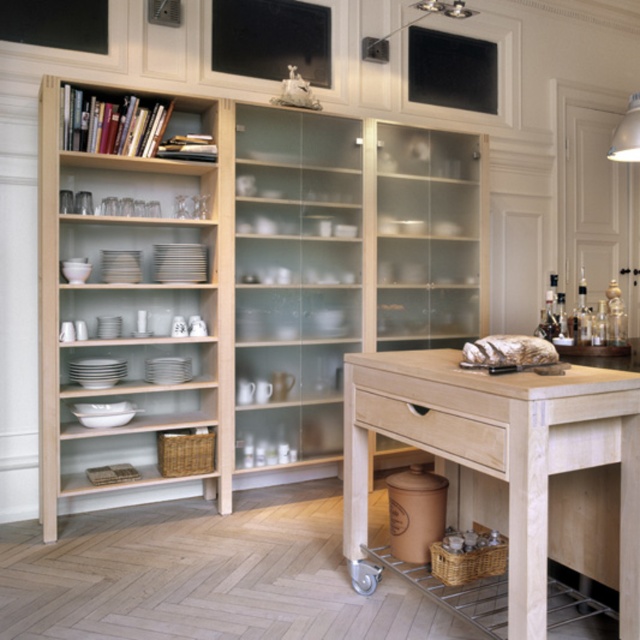
Who is positioned more to the right, light wood bookshelf at left or light wood drawer at center?

Positioned to the right is light wood drawer at center.

Can you confirm if light wood bookshelf at left is taller than light wood drawer at center?

Indeed, light wood bookshelf at left has a greater height compared to light wood drawer at center.

Which is in front, point (42, 275) or point (445, 432)?

Point (445, 432) is more forward.

You are a GUI agent. You are given a task and a screenshot of the screen. Output one action in this format:
    pyautogui.click(x=<x>, y=<y>)
    Task: Click on the light wood bookshelf at left
    Image resolution: width=640 pixels, height=640 pixels.
    Given the screenshot: What is the action you would take?
    pyautogui.click(x=138, y=307)

Between natural wood bookshelf at upper left and light wood table at center, which one is positioned higher?

Positioned higher is natural wood bookshelf at upper left.

Measure the distance between natural wood bookshelf at upper left and camera.

natural wood bookshelf at upper left is 3.03 meters away from camera.

Is point (317, 337) farther from camera compared to point (360, 516)?

That is True.

In order to click on natural wood bookshelf at upper left in this screenshot , I will do `click(244, 285)`.

Does point (240, 346) come in front of point (355, 404)?

That is False.

Is natural wood bookshelf at upper left further to the viewer compared to light wood drawer at center?

Yes, it is behind light wood drawer at center.

Between point (74, 326) and point (401, 432), which one is positioned behind?

The point (74, 326) is more distant.

This screenshot has height=640, width=640. Find the location of `natural wood bookshelf at upper left`. natural wood bookshelf at upper left is located at coordinates (244, 285).